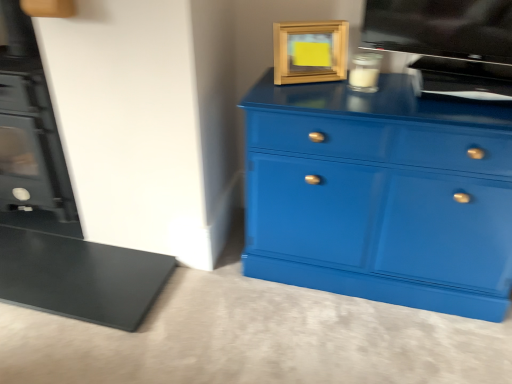
Image resolution: width=512 pixels, height=384 pixels. What are the coordinates of `vacant region in front of glossy blue chest of drawers at center` in the screenshot? It's located at [380, 339].